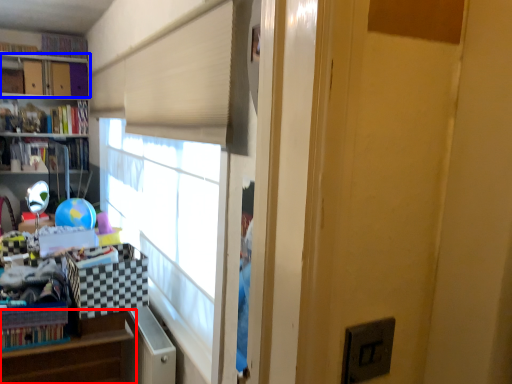
Question: Which point is closer to the camera, shelf (highlighted by a red box) or bookcase (highlighted by a blue box)?

Choices:
 (A) shelf
 (B) bookcase

Answer: (A)